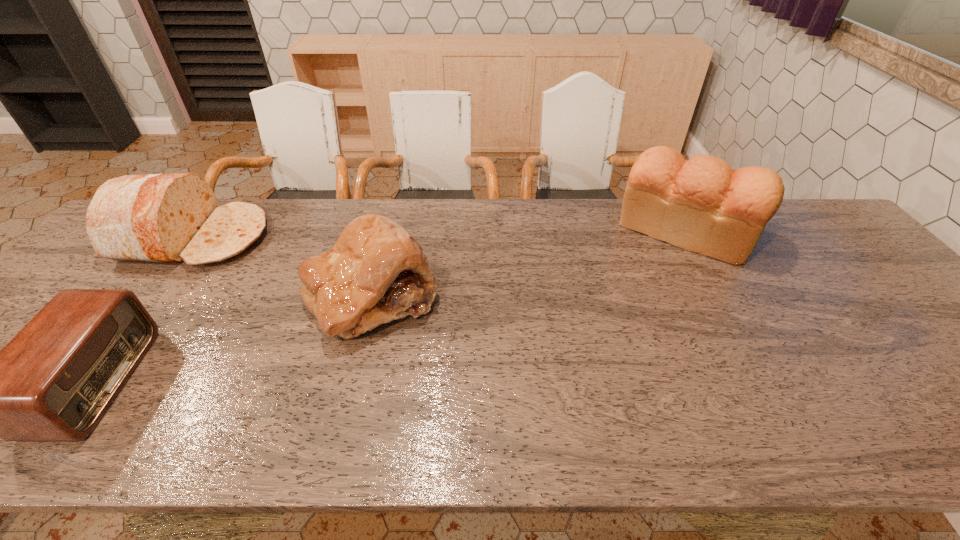
Where is `the tallest object`? the tallest object is located at coordinates (701, 205).

The height and width of the screenshot is (540, 960). What are the coordinates of `the tallest bread` in the screenshot? It's located at (701, 205).

You are a GUI agent. You are given a task and a screenshot of the screen. Output one action in this format:
    pyautogui.click(x=<x>, y=<y>)
    Task: Click on the leftmost bread
    This screenshot has height=540, width=960.
    Given the screenshot: What is the action you would take?
    pyautogui.click(x=167, y=218)

In order to click on the second bread from right to left in this screenshot , I will do `click(376, 272)`.

Find the location of a particular element. The height and width of the screenshot is (540, 960). the shortest object is located at coordinates (54, 381).

Where is `free space located on the left of the tallest object`? This screenshot has height=540, width=960. free space located on the left of the tallest object is located at coordinates (x=507, y=231).

The width and height of the screenshot is (960, 540). What are the coordinates of `vacant space situated 0.110m at the sliced end of the leftmost bread` in the screenshot? It's located at (302, 238).

Find the location of `vacant point located on the filling side of the second bread from right to left`. vacant point located on the filling side of the second bread from right to left is located at coordinates (347, 398).

Find the location of a particular element. free space located on the front panel of the shortest object is located at coordinates (179, 382).

At what (x,y) coordinates should I click in order to perform the action: click on object present at the near edge. Please return your answer as a coordinate pair (x, y). This screenshot has width=960, height=540. Looking at the image, I should click on (54, 381).